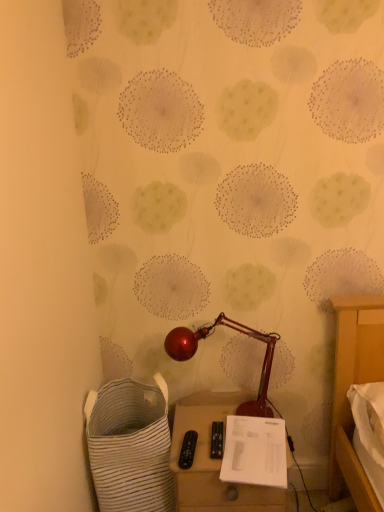
Identify the location of vacant space in shiny metallic lamp at center (from a real-world perspective). (208, 419).